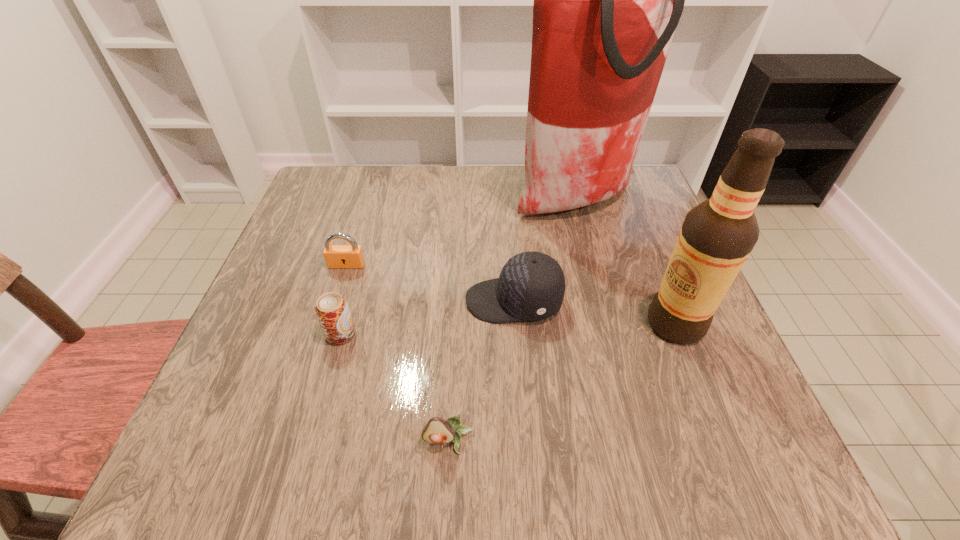
Identify the location of blank space located 0.130m on the label of the alcohol. point(581,324).

This screenshot has height=540, width=960. In order to click on free space located 0.280m at the front of the fourth shortest object where the brim is located in this screenshot , I will do `click(329, 301)`.

At what (x,y) coordinates should I click in order to perform the action: click on vacant space located 0.240m at the front of the fourth shortest object where the brim is located. Please return your answer as a coordinate pair (x, y). The height and width of the screenshot is (540, 960). Looking at the image, I should click on (349, 301).

The height and width of the screenshot is (540, 960). I want to click on vacant space located at the front of the fourth shortest object where the brim is located, so click(x=402, y=301).

Image resolution: width=960 pixels, height=540 pixels. I want to click on vacant space situated 0.270m on the back of the beer can, so click(x=369, y=235).

Where is `free location located to unlock the second farthest object from the front`? Image resolution: width=960 pixels, height=540 pixels. free location located to unlock the second farthest object from the front is located at coordinates (309, 384).

Where is `object that is at the far edge`? This screenshot has height=540, width=960. object that is at the far edge is located at coordinates (607, 0).

Identify the location of object that is positioned at the near edge. Image resolution: width=960 pixels, height=540 pixels. (438, 430).

Identify the location of beer can that is at the left edge. (332, 311).

Image resolution: width=960 pixels, height=540 pixels. In order to click on padlock that is at the left edge in this screenshot , I will do `click(351, 256)`.